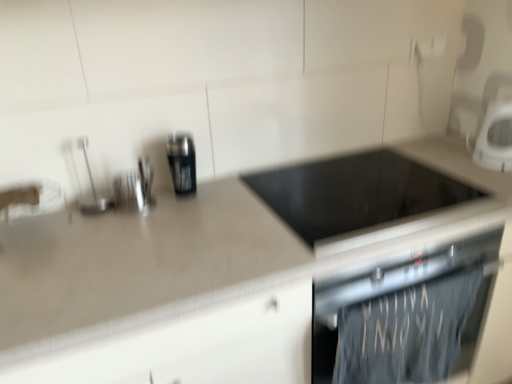
Question: Considering the relative sizes of dark gray fabric towel at lower right and black glass cooktop at center, the first appliance viewed from the right, in the image provided, is dark gray fabric towel at lower right bigger than black glass cooktop at center, the first appliance viewed from the right,?

Choices:
 (A) yes
 (B) no

Answer: (B)

Question: Does dark gray fabric towel at lower right turn towards black glass cooktop at center, positioned as the third appliance in left-to-right order?

Choices:
 (A) yes
 (B) no

Answer: (B)

Question: From the image's perspective, would you say dark gray fabric towel at lower right is positioned over black glass cooktop at center, the first appliance viewed from the right?

Choices:
 (A) yes
 (B) no

Answer: (B)

Question: Considering the relative sizes of dark gray fabric towel at lower right and black glass cooktop at center, the first appliance viewed from the right, in the image provided, is dark gray fabric towel at lower right thinner than black glass cooktop at center, the first appliance viewed from the right,?

Choices:
 (A) no
 (B) yes

Answer: (B)

Question: Can you see dark gray fabric towel at lower right touching black glass cooktop at center, the first appliance viewed from the right?

Choices:
 (A) no
 (B) yes

Answer: (A)

Question: From a real-world perspective, is dark gray fabric towel at lower right positioned over black glass cooktop at center, the first appliance viewed from the right, based on gravity?

Choices:
 (A) no
 (B) yes

Answer: (A)

Question: Is the depth of beige laminate countertop at center greater than that of brushed metal utensil holder at upper left, the 2th appliance viewed from the right?

Choices:
 (A) yes
 (B) no

Answer: (B)

Question: From the image's perspective, is beige laminate countertop at center located above brushed metal utensil holder at upper left, which appears as the 2th appliance when viewed from the left?

Choices:
 (A) no
 (B) yes

Answer: (A)

Question: Is beige laminate countertop at center smaller than brushed metal utensil holder at upper left, which appears as the 2th appliance when viewed from the left?

Choices:
 (A) no
 (B) yes

Answer: (A)

Question: Is brushed metal utensil holder at upper left, which appears as the 2th appliance when viewed from the left, at the back of beige laminate countertop at center?

Choices:
 (A) no
 (B) yes

Answer: (A)

Question: Is beige laminate countertop at center located outside brushed metal utensil holder at upper left, which appears as the 2th appliance when viewed from the left?

Choices:
 (A) yes
 (B) no

Answer: (A)

Question: From a real-world perspective, is beige laminate countertop at center located beneath brushed metal utensil holder at upper left, which appears as the 2th appliance when viewed from the left?

Choices:
 (A) no
 (B) yes

Answer: (B)

Question: Can you confirm if black glass cooktop at center, positioned as the third appliance in left-to-right order, is smaller than white glossy microwave at upper right, placed as the second kitchen appliance when sorted from left to right?

Choices:
 (A) yes
 (B) no

Answer: (B)